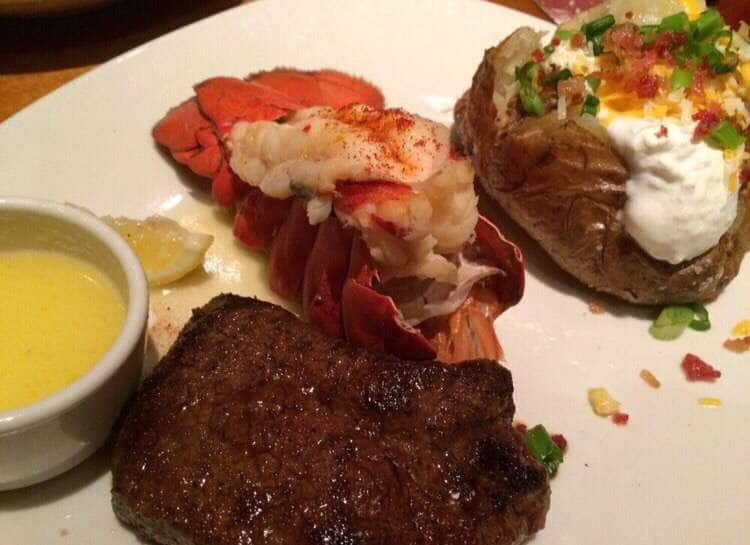
Find the location of a particular element. Image resolution: width=750 pixels, height=545 pixels. light brown wood is located at coordinates (31, 82).